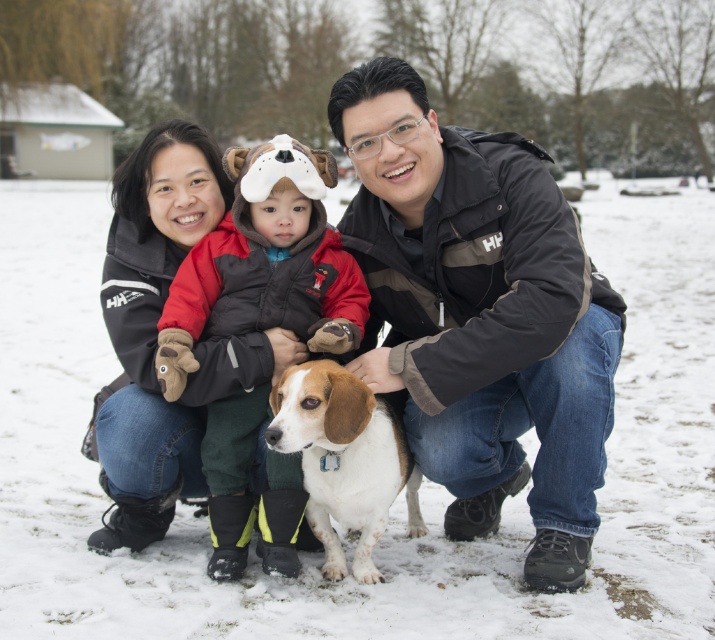
Question: Which point is farther to the camera?

Choices:
 (A) white fluffy snow at center
 (B) black fleece jacket at left
 (C) brown and white fur dog at center
 (D) velvet brown vest at center

Answer: (B)

Question: Estimate the real-world distances between objects in this image. Which object is closer to the velvet brown vest at center?

Choices:
 (A) white fluffy snow at center
 (B) brown and white fur dog at center
 (C) black jacket at center

Answer: (B)

Question: Is white fluffy snow at center thinner than brown and white fur dog at center?

Choices:
 (A) no
 (B) yes

Answer: (A)

Question: In this image, where is white fluffy snow at center located relative to velvet brown vest at center?

Choices:
 (A) above
 (B) below

Answer: (A)

Question: Which is farther from the black jacket at center?

Choices:
 (A) black fleece jacket at left
 (B) brown and white fur dog at center

Answer: (A)

Question: Where is velvet brown vest at center located in relation to brown and white fur dog at center in the image?

Choices:
 (A) below
 (B) above

Answer: (B)